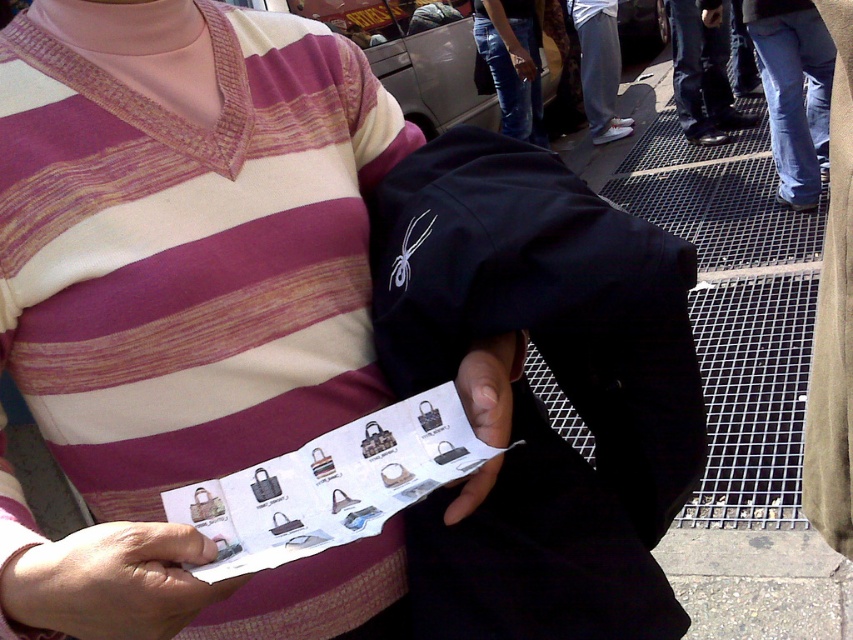
You are a delivery robot with a width of 1 meter. You are positioned near the jeans at lower right and need to reach the matte black bag at center. Is there enough space for you to move directly to the bag without any obstacles?

The distance between jeans at lower right and matte black bag at center is 1.31 meters. Since the robot is 1 meter wide, there is sufficient space to move directly to the bag as the distance is greater than the robot width.

You are a delivery robot in an urban area. You need to deliver a package to the person holding the booklet. The coordinates of the booklet are at point [112,580]. The booklet is on a white paper at center. Can you confirm the location of the booklet?

The point [112,580] is on white paper at center, so the booklet is located at the center of the white paper.

You are a photographer trying to capture the matte black bag at center and the jeans at lower right in a single frame. Based on their positions, which object will appear closer to the bottom edge of your photo?

The jeans at lower right is below the matte black bag at center, so it will appear closer to the bottom edge of the photo.